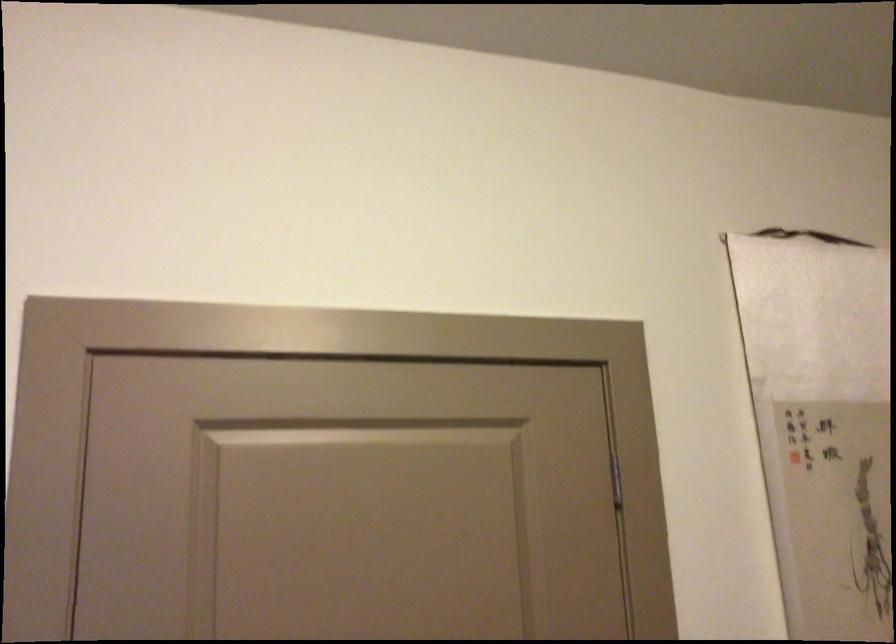
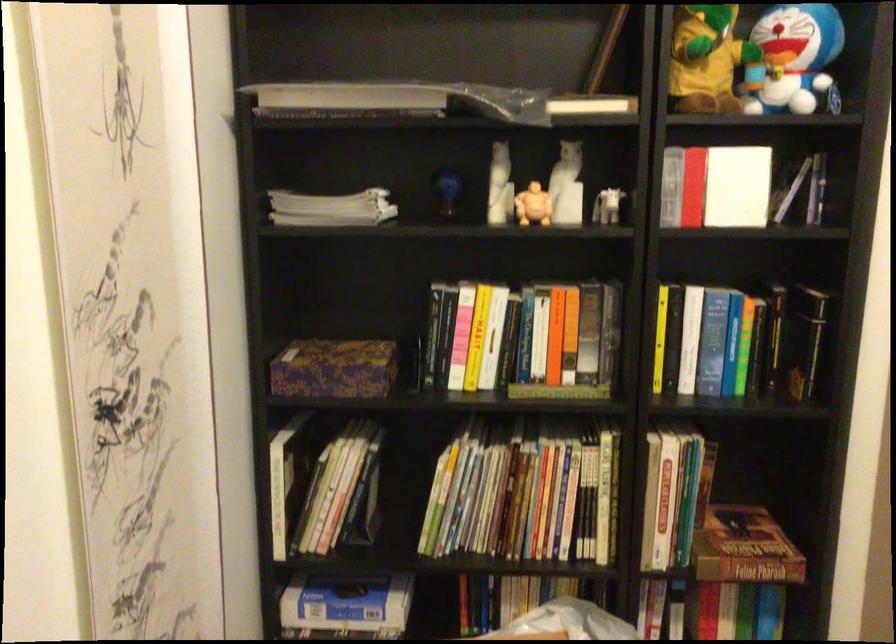
Question: The first image is from the beginning of the video and the second image is from the end. How did the camera likely rotate when shooting the video?

Choices:
 (A) Left
 (B) Right
 (C) Up
 (D) Down

Answer: (B)